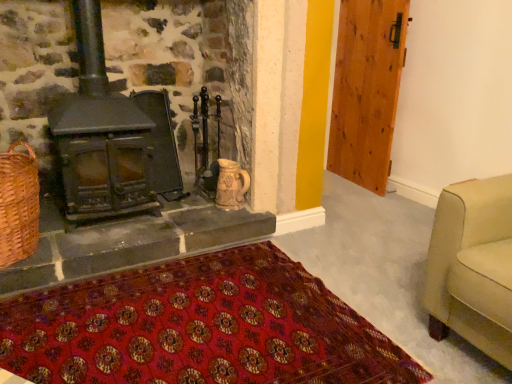
Question: Looking at their shapes, would you say wooden door at right is wider or thinner than woven brown basket at lower left?

Choices:
 (A) thin
 (B) wide

Answer: (A)

Question: From their relative heights in the image, would you say wooden door at right is taller or shorter than woven brown basket at lower left?

Choices:
 (A) short
 (B) tall

Answer: (B)

Question: Estimate the real-world distances between objects in this image. Which object is closer to the woven brown basket at lower left?

Choices:
 (A) red woven mat at lower center
 (B) wooden door at right
 (C) matte black wood burning stove at left

Answer: (C)

Question: Based on their relative distances, which object is nearer to the red woven mat at lower center?

Choices:
 (A) woven brown basket at lower left
 (B) wooden door at right
 (C) matte black wood burning stove at left

Answer: (A)